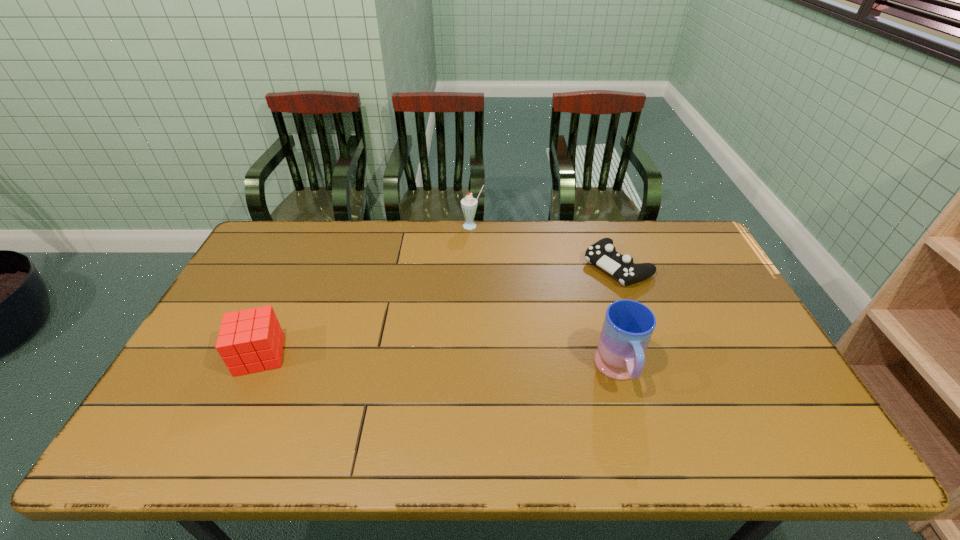
Where is `free space located on the surface of the third nearest object`? Image resolution: width=960 pixels, height=540 pixels. free space located on the surface of the third nearest object is located at coordinates (576, 293).

This screenshot has height=540, width=960. Find the location of `vacant space located on the straw side of the third object from right to left`. vacant space located on the straw side of the third object from right to left is located at coordinates (461, 284).

Locate an element on the screen. Image resolution: width=960 pixels, height=540 pixels. vacant space located on the straw side of the third object from right to left is located at coordinates (461, 282).

The height and width of the screenshot is (540, 960). Find the location of `vacant space located 0.150m on the straw side of the third object from right to left`. vacant space located 0.150m on the straw side of the third object from right to left is located at coordinates (467, 256).

Identify the location of control at the far edge. (602, 253).

The width and height of the screenshot is (960, 540). Find the location of `milkshake present at the far edge`. milkshake present at the far edge is located at coordinates (469, 204).

You are a GUI agent. You are given a task and a screenshot of the screen. Output one action in this format:
    pyautogui.click(x=<x>, y=<y>)
    Task: Click on the object situated at the near edge
    This screenshot has height=540, width=960.
    Given the screenshot: What is the action you would take?
    pyautogui.click(x=628, y=325)

I want to click on object present at the left edge, so click(x=249, y=341).

The image size is (960, 540). Find the location of `vacant space at the far edge of the desktop`. vacant space at the far edge of the desktop is located at coordinates (413, 229).

The image size is (960, 540). I want to click on vacant space at the near edge of the desktop, so click(x=301, y=415).